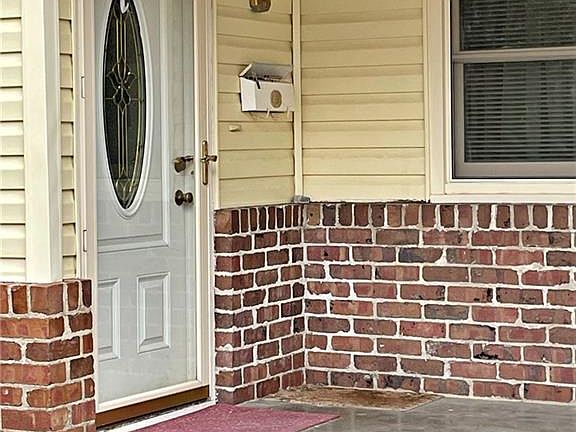
At what (x,y) coordinates should I click in order to perform the action: click on door. Please return your answer as a coordinate pair (x, y). Looking at the image, I should click on (170, 213).